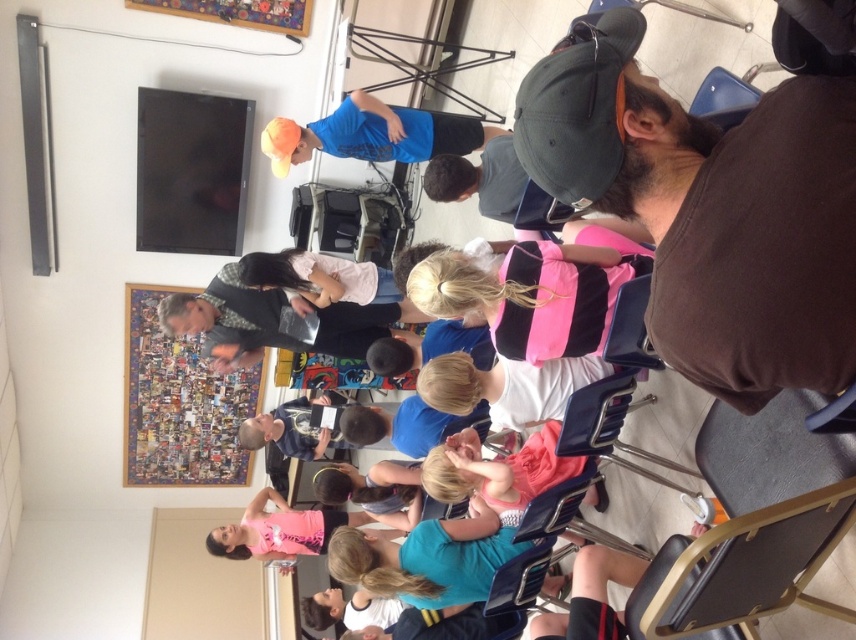
You are a photographer positioned at the entrance of the room. You need to take a photo that captures both the brown matte shirt at upper right and the pink striped vest at center. Which of the two should you focus on first to ensure both are in sharp focus?

The brown matte shirt at upper right is closer to the viewer than the pink striped vest at center. To ensure both are in sharp focus, you should focus on the brown matte shirt at upper right first, as focusing on the closer object helps achieve depth of field that can include the farther one.

You are standing in the room and see two points marked in the image. Which point is closer to you, point (x=378, y=556) or point (x=251, y=541)?

Point (x=378, y=556) is closer to the viewer than point (x=251, y=541).

You are a photographer in the room and want to take a photo of the brown matte shirt at upper right. Which direction should you move to get it centered in your viewfinder?

The brown matte shirt at upper right is located at point 0.328 on the x axis and 0.832 on the y axis. To center it, move left and down.